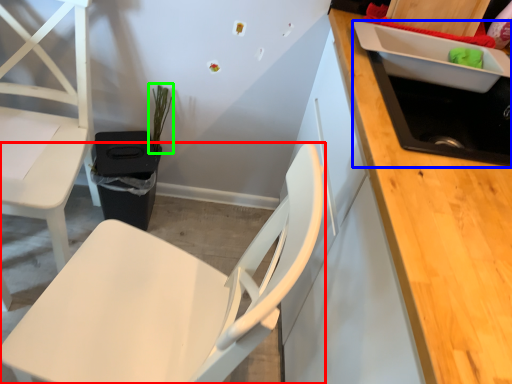
Question: Considering the real-world distances, which object is farthest from chair (highlighted by a red box)? sink (highlighted by a blue box) or plant (highlighted by a green box)?

Choices:
 (A) sink
 (B) plant

Answer: (B)